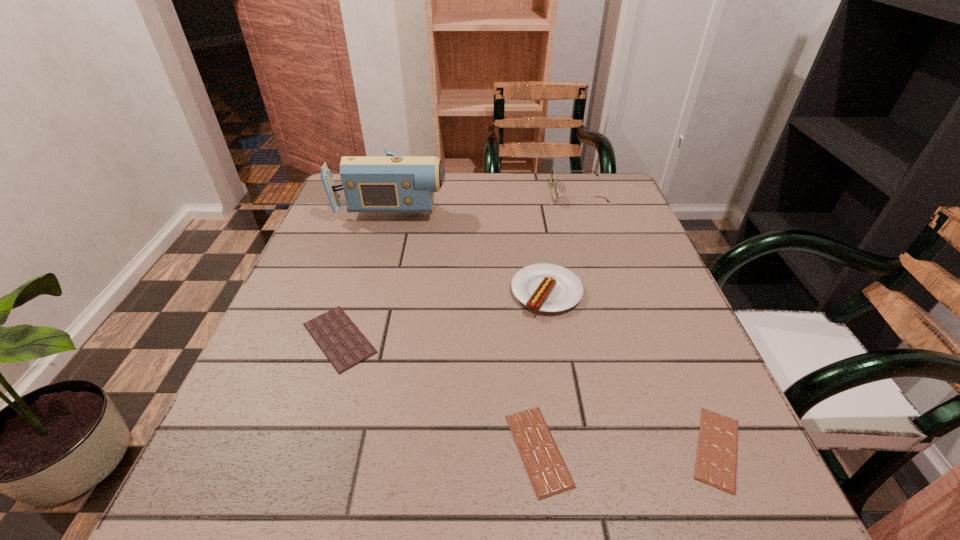
Select which object appears as the closest to the rightmost chocolate bar. Please provide its 2D coordinates. Your answer should be formatted as a tuple, i.e. [(x, y)], where the tuple contains the x and y coordinates of a point satisfying the conditions above.

[(549, 475)]

The width and height of the screenshot is (960, 540). I want to click on the closest object to the fourth tallest object, so click(x=549, y=475).

At what (x,y) coordinates should I click in order to perform the action: click on chocolate bar that is the second closest one to the second chocolate bar from right to left. Please return your answer as a coordinate pair (x, y). Looking at the image, I should click on (344, 345).

Find the location of a particular element. The width and height of the screenshot is (960, 540). chocolate bar identified as the closest to the second chocolate bar from left to right is located at coordinates (716, 462).

Locate an element on the screen. Image resolution: width=960 pixels, height=540 pixels. free location that satisfies the following two spatial constraints: 1. on the side of the tallest object with the flip-out screen; 2. on the back side of the sausage is located at coordinates (371, 292).

Find the location of `free space that satisfies the following two spatial constraints: 1. on the side of the second chocolate bar from left to right with the flip-out screen; 2. on the right side of the camcorder`. free space that satisfies the following two spatial constraints: 1. on the side of the second chocolate bar from left to right with the flip-out screen; 2. on the right side of the camcorder is located at coordinates 327,450.

This screenshot has width=960, height=540. I want to click on vacant point that satisfies the following two spatial constraints: 1. on the side of the tallest object with the flip-out screen; 2. on the right side of the second chocolate bar from right to left, so click(x=327, y=450).

The height and width of the screenshot is (540, 960). Identify the location of vacant space that satisfies the following two spatial constraints: 1. on the side of the camcorder with the flip-out screen; 2. on the left side of the second chocolate bar from left to right. (327, 450).

Image resolution: width=960 pixels, height=540 pixels. I want to click on vacant region that satisfies the following two spatial constraints: 1. on the side of the second chocolate bar from right to left with the flip-out screen; 2. on the right side of the tallest object, so click(x=327, y=450).

At what (x,y) coordinates should I click in order to perform the action: click on free location that satisfies the following two spatial constraints: 1. on the side of the tallest object with the flip-out screen; 2. on the left side of the second chocolate bar from right to left. Please return your answer as a coordinate pair (x, y). The width and height of the screenshot is (960, 540). Looking at the image, I should click on (327, 450).